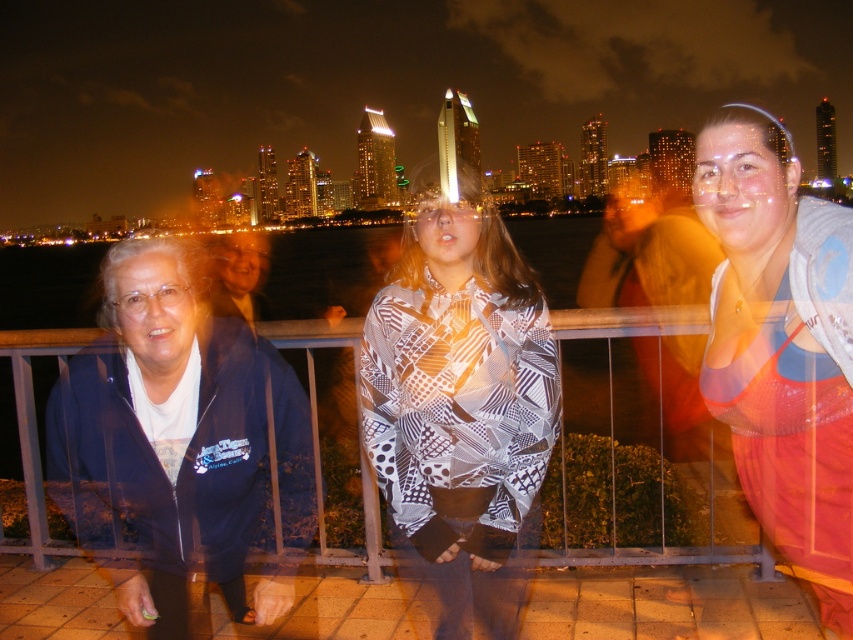
Question: Can you confirm if matte gray tank top at right is wider than metallic silver fence at center?

Choices:
 (A) yes
 (B) no

Answer: (A)

Question: Among these objects, which one is farthest from the camera?

Choices:
 (A) metallic silver fence at center
 (B) blue zip-up jacket at left
 (C) printed fabric blouse at center
 (D) matte gray tank top at right

Answer: (C)

Question: Which of the following is the farthest from the observer?

Choices:
 (A) blue zip-up jacket at left
 (B) matte gray tank top at right
 (C) metallic silver fence at center
 (D) printed fabric blouse at center

Answer: (D)

Question: Estimate the real-world distances between objects in this image. Which object is farther from the matte gray tank top at right?

Choices:
 (A) metallic silver fence at center
 (B) blue zip-up jacket at left

Answer: (B)

Question: Does blue zip-up jacket at left appear on the left side of metallic silver fence at center?

Choices:
 (A) no
 (B) yes

Answer: (B)

Question: From the image, what is the correct spatial relationship of printed fabric blouse at center in relation to metallic silver fence at center?

Choices:
 (A) above
 (B) below

Answer: (A)